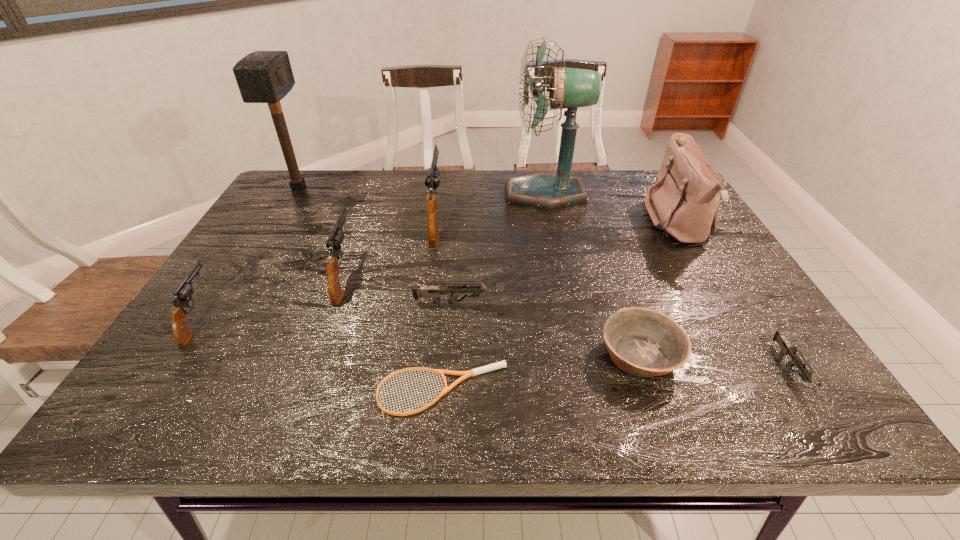
You are a GUI agent. You are given a task and a screenshot of the screen. Output one action in this format:
    pyautogui.click(x=<x>, y=<y>)
    Task: Click on the empty space that is in between the shoulder bag and the bowl
    
    Given the screenshot: What is the action you would take?
    pyautogui.click(x=659, y=289)

Locate an element on the screen. The image size is (960, 540). free spot between the fan and the bigger grey gun is located at coordinates (503, 248).

Where is `vacant area that lies between the left grey gun and the leftmost black gun`? vacant area that lies between the left grey gun and the leftmost black gun is located at coordinates (330, 310).

Identify the location of free area in between the beige tennis racket and the second biggest black gun. (393, 333).

You are a GUI agent. You are given a task and a screenshot of the screen. Output one action in this format:
    pyautogui.click(x=<x>, y=<y>)
    Task: Click on the blank region between the bowl and the biggest black gun
    
    Given the screenshot: What is the action you would take?
    pyautogui.click(x=538, y=287)

Point out which object is positioned as the third nearest to the shortest gun. Please provide its 2D coordinates. Your answer should be formatted as a tuple, i.e. [(x, y)], where the tuple contains the x and y coordinates of a point satisfying the conditions above.

[(434, 292)]

You are a GUI agent. You are given a task and a screenshot of the screen. Output one action in this format:
    pyautogui.click(x=<x>, y=<y>)
    Task: Click on the object that is the sixth closest to the shortest gun
    This screenshot has width=960, height=540.
    Given the screenshot: What is the action you would take?
    pyautogui.click(x=432, y=180)

Locate which gun ranks in proximity to the bowl. Please provide its 2D coordinates. Your answer should be formatted as a tuple, i.e. [(x, y)], where the tuple contains the x and y coordinates of a point satisfying the conditions above.

[(434, 292)]

The height and width of the screenshot is (540, 960). In order to click on gun identified as the fifth closest to the blue fan in this screenshot , I will do `click(183, 294)`.

Image resolution: width=960 pixels, height=540 pixels. I want to click on black gun identified as the closest to the fourth tallest object, so click(x=334, y=242).